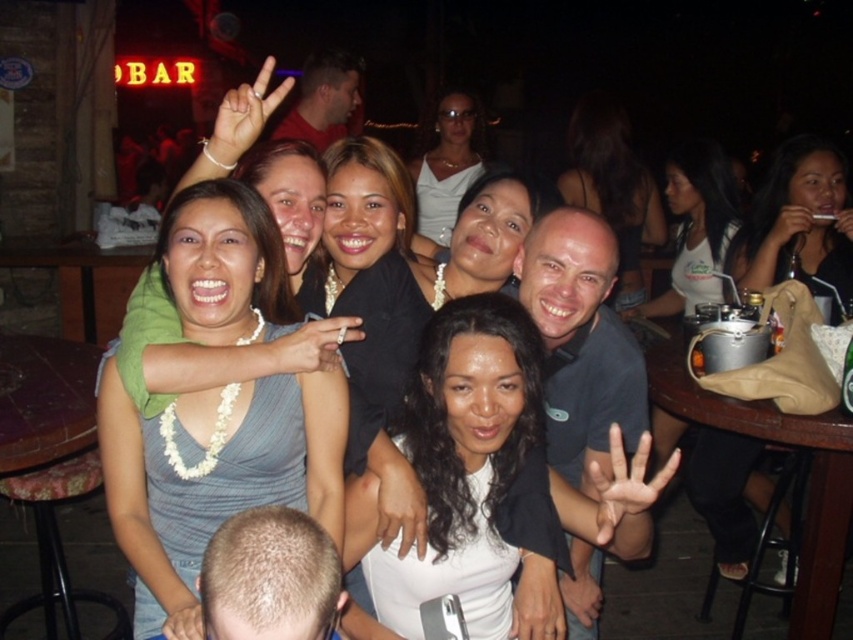
Question: Which point appears closest to the camera in this image?

Choices:
 (A) (314, 68)
 (B) (682, 200)

Answer: (B)

Question: Does bald head at center appear over white pearl necklace at center?

Choices:
 (A) yes
 (B) no

Answer: (B)

Question: Observing the image, what is the correct spatial positioning of bald head at center in reference to matte black hair at center?

Choices:
 (A) below
 (B) above

Answer: (A)

Question: Which of the following is the closest to the observer?

Choices:
 (A) (689, 285)
 (B) (306, 376)

Answer: (B)

Question: Among these objects, which one is farthest from the camera?

Choices:
 (A) dark blue shirt at center
 (B) white satin dress at center

Answer: (B)

Question: Is the position of bald head at center more distant than that of white pearl necklace at center?

Choices:
 (A) yes
 (B) no

Answer: (B)